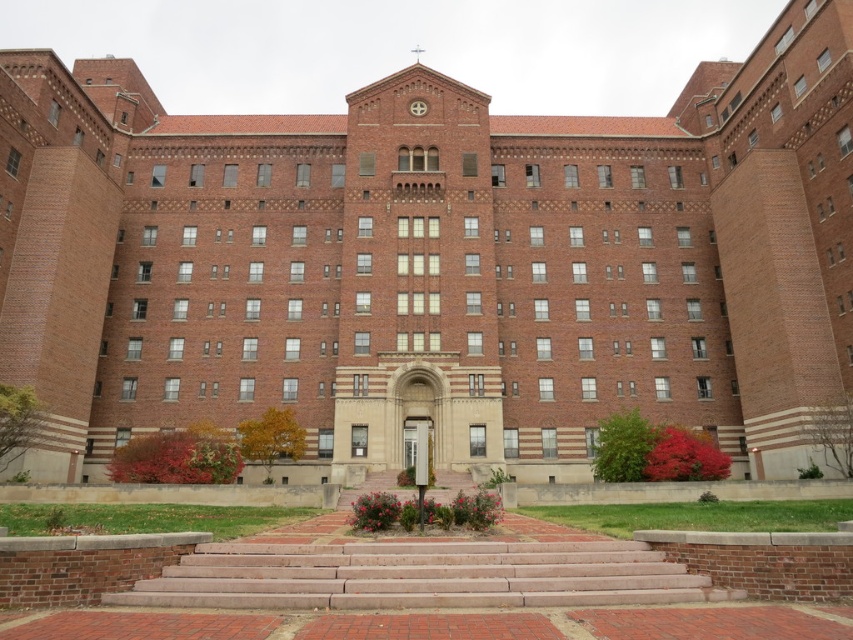
Consider the image. You are standing in front of the building and want to enter through the entrance. Where are the brick stairs at center located relative to the entrance?

The brick stairs at center are located at point (x=421, y=577) relative to the entrance, meaning they are positioned to the right and slightly below the entrance.

You are a visitor approaching the entrance of the building. You see the brick stairs at center and the matte brick clock at center. Which one is located to the right of the other?

The brick stairs at center is positioned on the right side of matte brick clock at center.